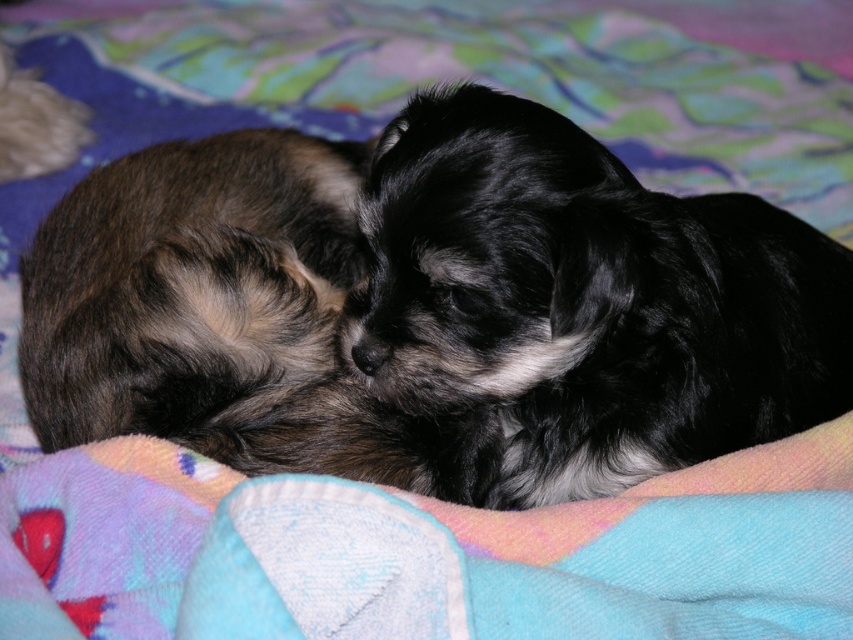
Looking at this image, who is taller, black fluffy dog at center or soft brown fur at upper left?

black fluffy dog at center is taller.

Is point (599, 353) positioned behind point (24, 163)?

No, it is in front of (24, 163).

The image size is (853, 640). In order to click on black fluffy dog at center in this screenshot , I will do `click(584, 301)`.

The height and width of the screenshot is (640, 853). Find the location of `black fluffy dog at center`. black fluffy dog at center is located at coordinates (584, 301).